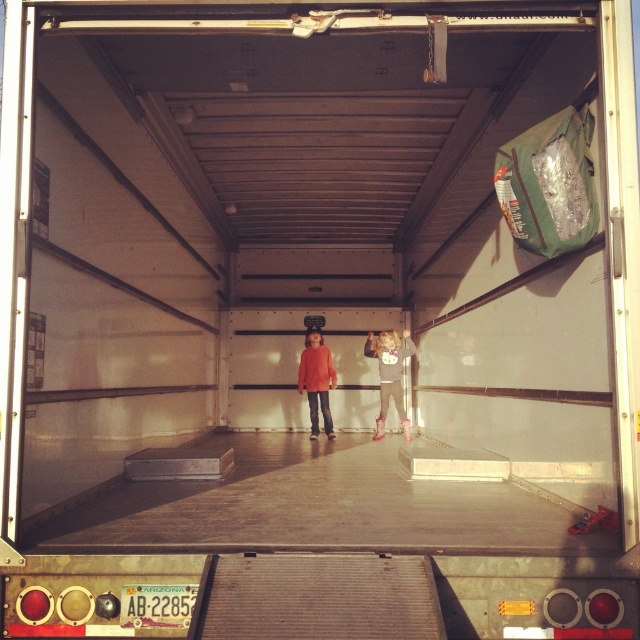
You are a delivery person who needs to load a package into the truck. The package is too heavy for you to lift above your head. You see the matte gray sweater at center and the matte orange sweater at center. Which sweater should you place the package on top of to ensure it doesn

The matte gray sweater at center is below the matte orange sweater at center, so placing the package on the matte orange sweater at center would ensure it is higher up and within reach without needing to lift it above your head.

You are a delivery robot inside the truck and need to navigate between the two points marked as point [408,420] and point [317,336]. Which point is closer to your current position if you are facing the open rear doors?

Point [408,420] is closer to the camera, so if you are facing the open rear doors, this point would be nearer to your current position.

You are a delivery person who needs to locate the matte gray sweater at center in the truck. Based on the truck layout described, where should you look?

The matte gray sweater at center is located at point coordinates (388, 374), so you should look near the middle of the truck, slightly towards the right side.